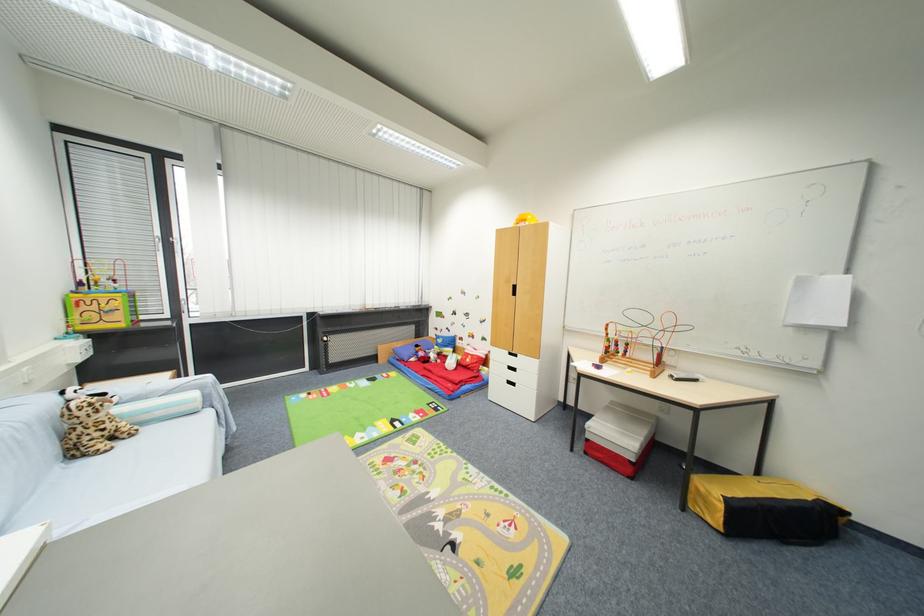
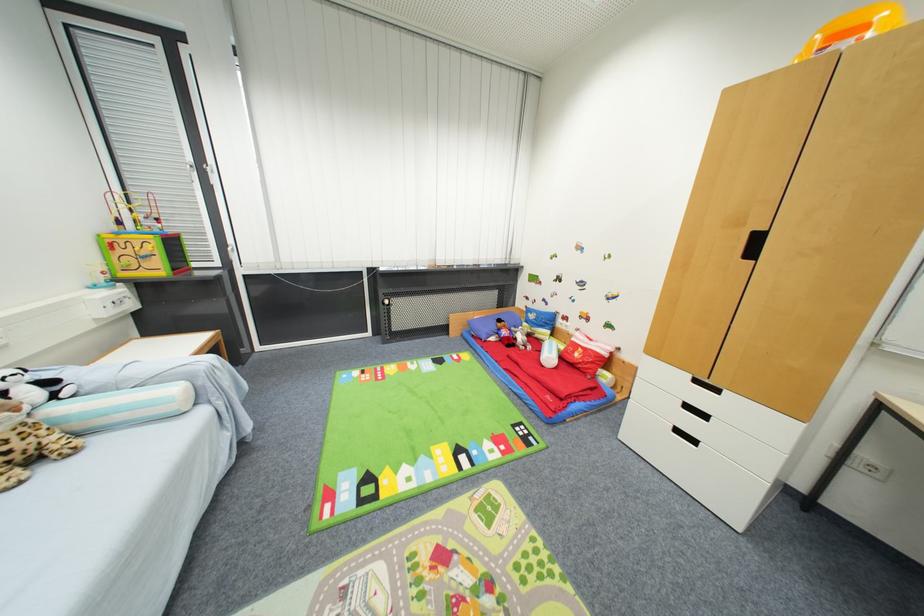
Where in the second image is the point corresponding to point 513,354 from the first image?

(695, 378)